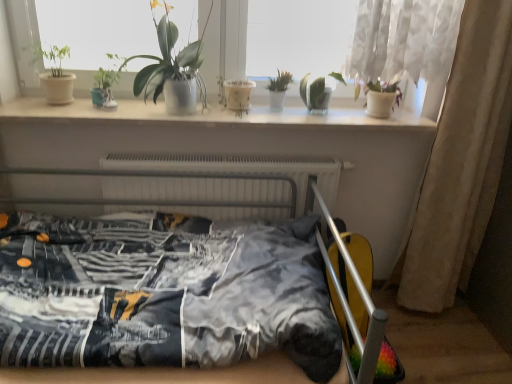
This screenshot has height=384, width=512. I want to click on free spot in front of green matte plant pot at upper left, the 5th houseplant when ordered from right to left, so click(x=53, y=107).